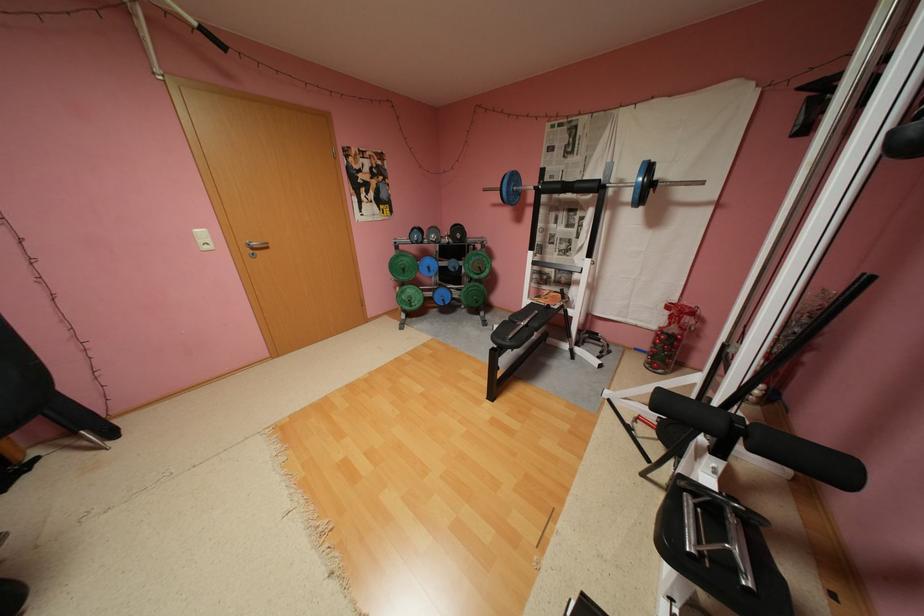
The width and height of the screenshot is (924, 616). What do you see at coordinates (762, 440) in the screenshot?
I see `the black pull-up grip` at bounding box center [762, 440].